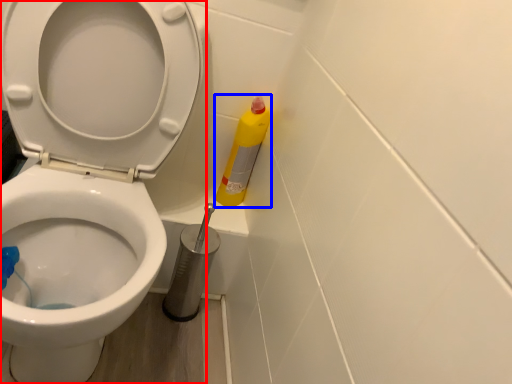
Question: Which of the following is the farthest to the observer, toilet (highlighted by a red box) or cleaning product (highlighted by a blue box)?

Choices:
 (A) toilet
 (B) cleaning product

Answer: (B)